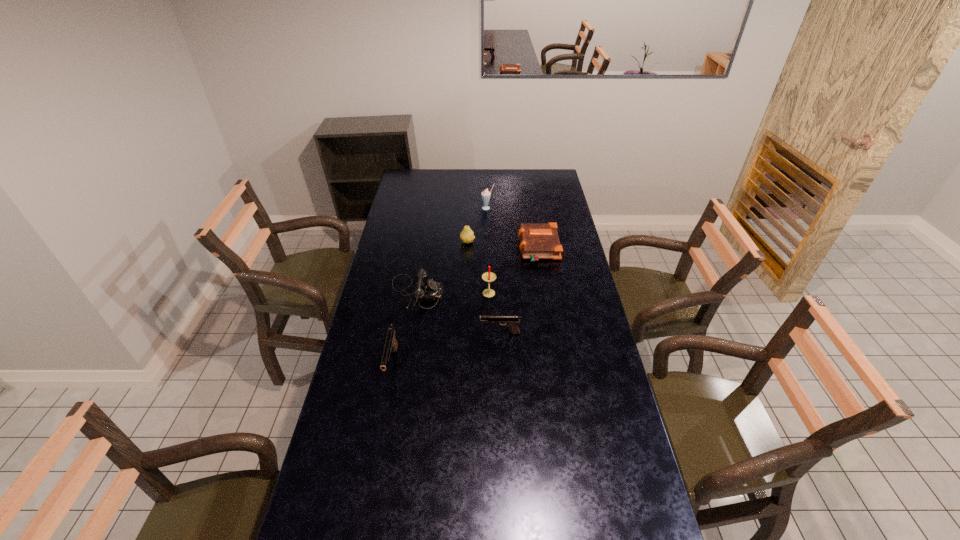
Image resolution: width=960 pixels, height=540 pixels. What are the coordinates of `vacant space located 0.210m at the muzzle of the nearest object` in the screenshot? It's located at (376, 447).

I want to click on free space located 0.330m at the muzzle of the shorter pistol, so click(392, 333).

This screenshot has width=960, height=540. I want to click on vacant space located at the muzzle of the shorter pistol, so click(450, 333).

Where is `vacant space located at the muzzle of the shorter pistol`? vacant space located at the muzzle of the shorter pistol is located at coordinates (390, 333).

At what (x,y) coordinates should I click in order to perform the action: click on free space located 0.250m on the straw side of the farthest object. Please return your answer as a coordinate pair (x, y). Looking at the image, I should click on (489, 239).

I want to click on vacant region located 0.360m on the spine side of the Bible, so click(442, 248).

I want to click on vacant space situated 0.230m on the spine side of the Bible, so click(469, 248).

The height and width of the screenshot is (540, 960). Find the location of `vacant point located on the spine side of the Bible`. vacant point located on the spine side of the Bible is located at coordinates (435, 248).

Locate an element on the screen. free region located 0.360m on the front-facing side of the telephone is located at coordinates (531, 293).

I want to click on vacant space located 0.050m on the front of the candle, so click(490, 309).